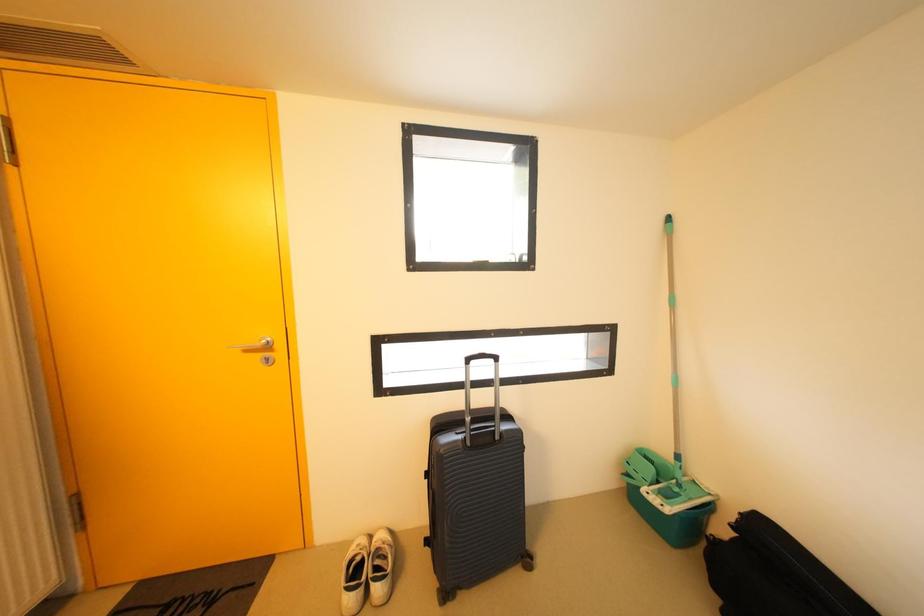
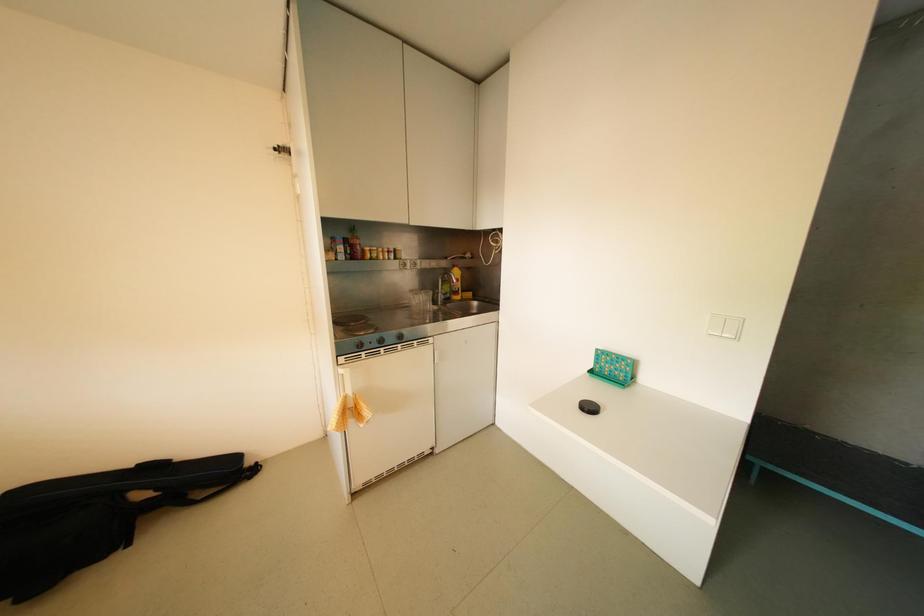
Question: Based on the continuous images, in which direction is the camera rotating? Reply with the corresponding letter.

Choices:
 (A) Left
 (B) Right
 (C) Up
 (D) Down

Answer: (B)